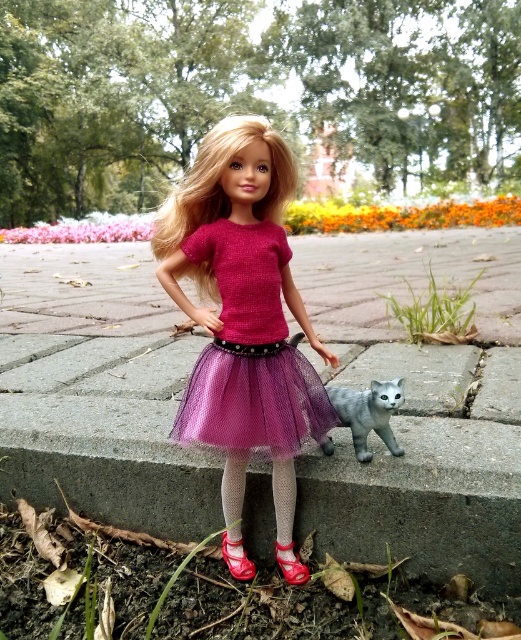
Question: Which point is closer to the camera?

Choices:
 (A) shiny red shoe at lower center
 (B) matte pink tulle skirt at center
 (C) purple tulle dress at center
 (D) shiny pink leather shoe at lower center

Answer: (B)

Question: Observing the image, what is the correct spatial positioning of purple tulle dress at center in reference to shiny pink leather shoe at lower center?

Choices:
 (A) below
 (B) above

Answer: (B)

Question: Does matte pink tulle skirt at center have a smaller size compared to shiny red shoe at lower center?

Choices:
 (A) no
 (B) yes

Answer: (A)

Question: Which point is closer to the camera taking this photo?

Choices:
 (A) (217, 433)
 (B) (293, 579)
 (C) (241, 276)
 (D) (240, 577)

Answer: (A)

Question: Does matte pink tulle skirt at center come behind purple tulle dress at center?

Choices:
 (A) no
 (B) yes

Answer: (A)

Question: Which of the following is the farthest from the observer?

Choices:
 (A) purple tulle dress at center
 (B) matte pink tulle skirt at center
 (C) shiny pink leather shoe at lower center
 (D) shiny red shoe at lower center

Answer: (D)